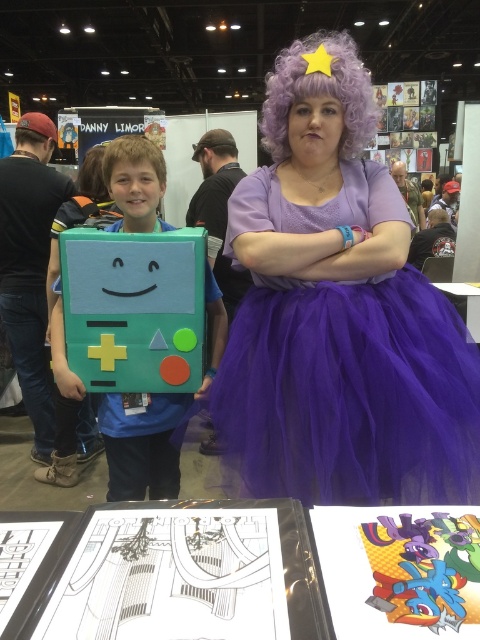
Question: Which of these objects is positioned farthest from the matte cardboard box at left?

Choices:
 (A) purple tulle dress at center
 (B) multicolored paper art at center

Answer: (B)

Question: Which of the following is the farthest from the observer?

Choices:
 (A) tap(80, 380)
 (B) tap(471, 593)
 (C) tap(433, 346)

Answer: (A)

Question: Does purple tulle dress at center have a lesser width compared to matte cardboard box at left?

Choices:
 (A) yes
 (B) no

Answer: (B)

Question: Can you confirm if purple tulle dress at center is smaller than matte cardboard box at left?

Choices:
 (A) yes
 (B) no

Answer: (B)

Question: Estimate the real-world distances between objects in this image. Which object is farther from the matte cardboard box at left?

Choices:
 (A) multicolored paper art at center
 (B) purple tulle dress at center

Answer: (A)

Question: Does purple tulle dress at center appear on the right side of matte cardboard box at left?

Choices:
 (A) yes
 (B) no

Answer: (A)